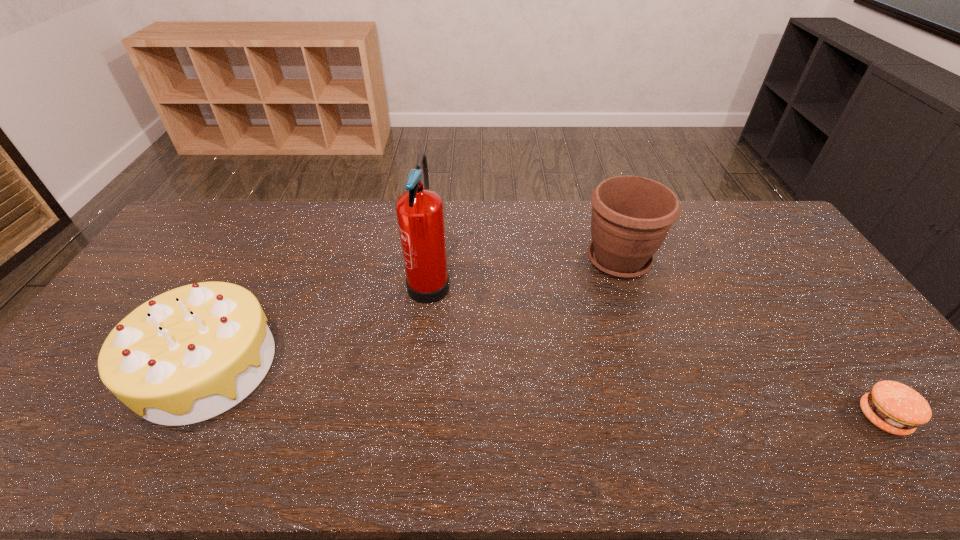
In order to click on free space that is in between the birthday cake and the flowerpot in this screenshot , I will do `click(413, 313)`.

Choose which object is the third nearest neighbor to the patty. Please provide its 2D coordinates. Your answer should be formatted as a tuple, i.e. [(x, y)], where the tuple contains the x and y coordinates of a point satisfying the conditions above.

[(187, 355)]

The image size is (960, 540). I want to click on object that is the second nearest to the second shortest object, so click(x=631, y=216).

This screenshot has height=540, width=960. I want to click on vacant space that satisfies the following two spatial constraints: 1. on the back side of the birthday cake; 2. on the right side of the flowerpot, so click(x=263, y=260).